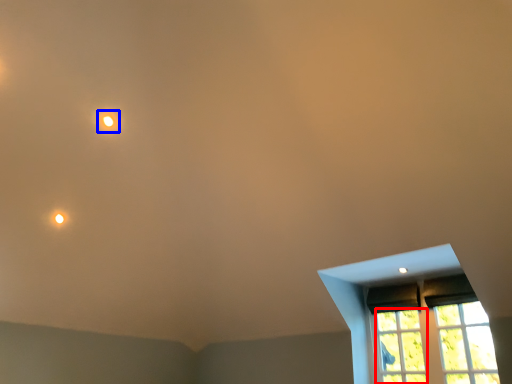
Question: Which object appears closest to the camera in this image, glass window (highlighted by a red box) or light (highlighted by a blue box)?

Choices:
 (A) glass window
 (B) light

Answer: (A)